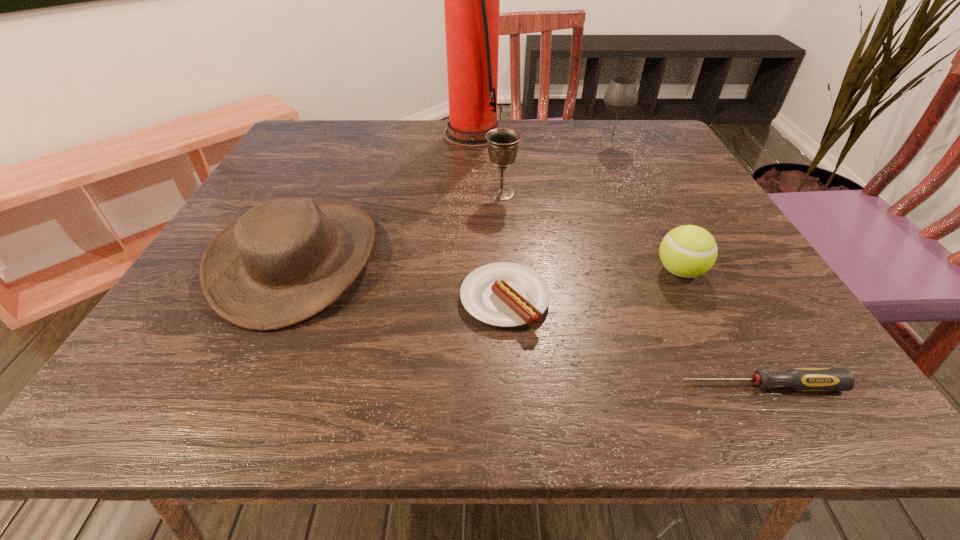
The height and width of the screenshot is (540, 960). In order to click on free space between the nearest object and the second shortest object in this screenshot , I will do `click(632, 342)`.

Select which object appears as the closest to the tennis ball. Please provide its 2D coordinates. Your answer should be formatted as a tuple, i.e. [(x, y)], where the tuple contains the x and y coordinates of a point satisfying the conditions above.

[(800, 379)]

The height and width of the screenshot is (540, 960). I want to click on the second closest object to the nearest object, so click(503, 294).

In order to click on blank space that satisfies the following two spatial constraints: 1. at the discharge end of the fire extinguisher; 2. on the right side of the sixth tallest object in this screenshot , I will do `click(469, 299)`.

Locate an element on the screen. vacant space that satisfies the following two spatial constraints: 1. on the front side of the leftmost object; 2. on the left side of the second shortest object is located at coordinates (279, 299).

Image resolution: width=960 pixels, height=540 pixels. Find the location of `vacant space that satisfies the following two spatial constraints: 1. at the discharge end of the wineglass; 2. on the right side of the fire extinguisher`. vacant space that satisfies the following two spatial constraints: 1. at the discharge end of the wineglass; 2. on the right side of the fire extinguisher is located at coordinates pyautogui.click(x=473, y=144).

The image size is (960, 540). I want to click on vacant space that satisfies the following two spatial constraints: 1. at the discharge end of the tallest object; 2. on the right side of the chalice, so click(472, 193).